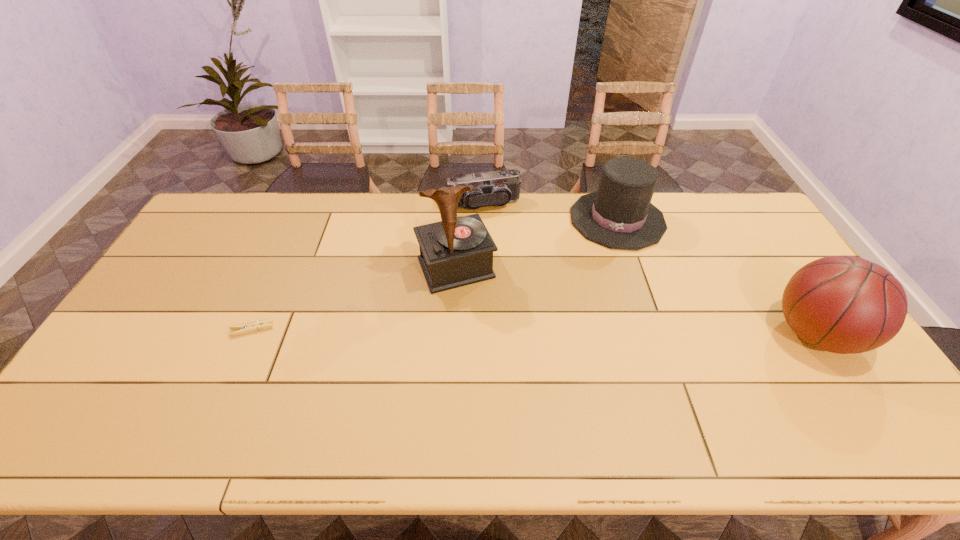
Find the location of a particular element. vacant space on the desktop that is between the leftmost object and the rightmost object and is positioned on the front of the fourth object from left to right with the decoration is located at coordinates (591, 332).

Locate an element on the screen. The height and width of the screenshot is (540, 960). free space on the desktop that is between the clothespin and the second tallest object and is positioned on the front-facing side of the camcorder is located at coordinates (523, 332).

Where is `free space on the desktop that is between the leftmost object and the second tallest object and is positioned at the horn opening of the tallest object`? The width and height of the screenshot is (960, 540). free space on the desktop that is between the leftmost object and the second tallest object and is positioned at the horn opening of the tallest object is located at coordinates (484, 331).